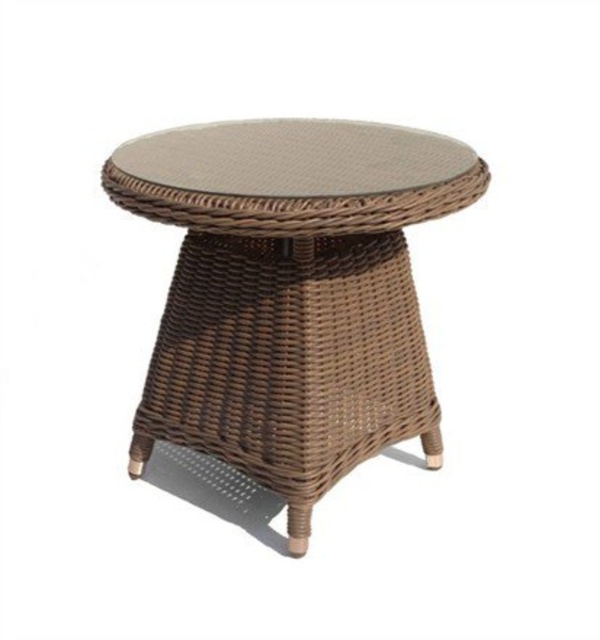
You are setting up a small outdoor space and have both a brown woven side table at center and a brown woven table at center. Which one should you choose if you want the taller piece for placing a lamp?

The brown woven side table at center is taller than the brown woven table at center, so you should choose the brown woven side table at center for placing a lamp.

You are standing at the origin point of the coordinate system in the image. You want to place a decorative item exactly at the center of the brown woven side table at center. What are the coordinates where you should place it?

The coordinates for the center of the brown woven side table at center are exactly at point [292,294].